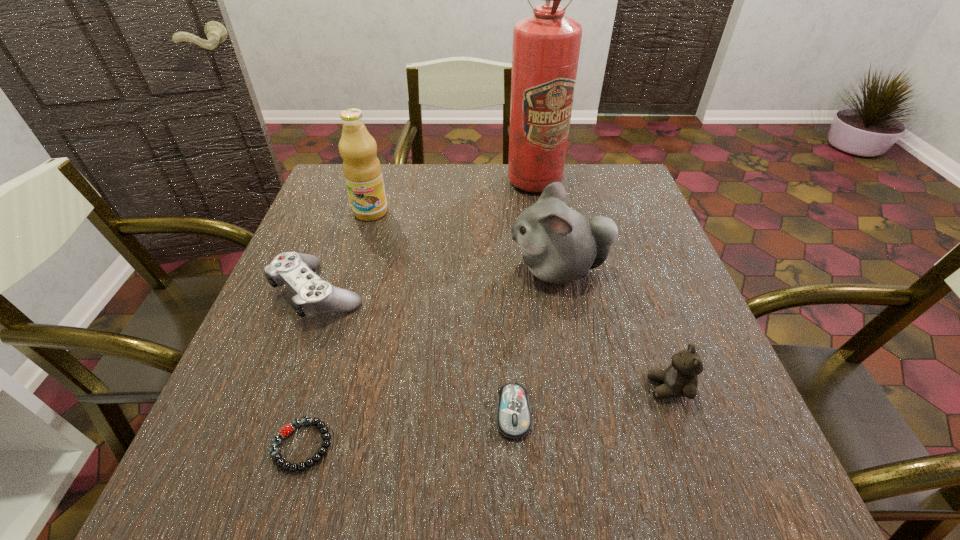
The width and height of the screenshot is (960, 540). Identify the location of free space between the olive oil and the bracelet. (337, 329).

Identify the location of vacant area between the computer mouse and the fourth tallest object. The height and width of the screenshot is (540, 960). (590, 401).

The height and width of the screenshot is (540, 960). I want to click on vacant region between the fire extinguisher and the shortest object, so pyautogui.click(x=419, y=313).

I want to click on free space that is in between the second tallest object and the second shortest object, so click(442, 313).

In order to click on free space that is in between the hamster and the computer mouse in this screenshot , I will do `click(536, 341)`.

Identify the location of free space between the olive oil and the rightmost object. The height and width of the screenshot is (540, 960). (519, 300).

Locate an element on the screen. This screenshot has height=540, width=960. vacant space that is in between the third tallest object and the bracelet is located at coordinates (430, 357).

At what (x,y) coordinates should I click in order to perform the action: click on object that is the fourth closest one to the second shortest object. Please return your answer as a coordinate pair (x, y). The image size is (960, 540). Looking at the image, I should click on (313, 296).

Choose which object is the sixth nearest neighbor to the computer mouse. Please provide its 2D coordinates. Your answer should be formatted as a tuple, i.e. [(x, y)], where the tuple contains the x and y coordinates of a point satisfying the conditions above.

[(546, 45)]

I want to click on vacant space that satisfies the following two spatial constraints: 1. on the face of the rightmost object; 2. on the wheel side of the computer mouse, so click(x=677, y=413).